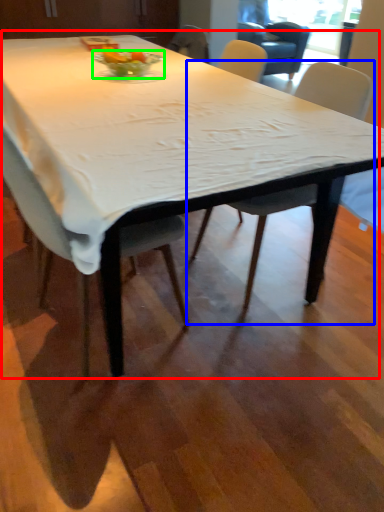
Question: Estimate the real-world distances between objects in this image. Which object is farther from table (highlighted by a red box), chair (highlighted by a blue box) or glass bowl (highlighted by a green box)?

Choices:
 (A) chair
 (B) glass bowl

Answer: (A)